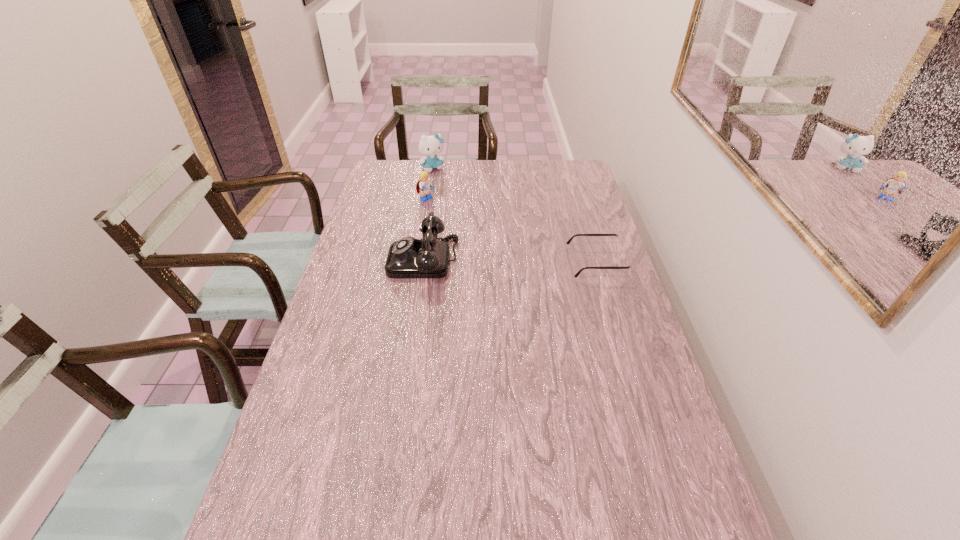
You are a GUI agent. You are given a task and a screenshot of the screen. Output one action in this format:
    pyautogui.click(x=<x>, y=<y>)
    Task: Click on the free space on the desktop that is between the telephone and the spectacles and is positioned on the front-facing side of the Lego
    
    Given the screenshot: What is the action you would take?
    pyautogui.click(x=522, y=261)

The height and width of the screenshot is (540, 960). Identify the location of vacant space on the desktop that is between the telephone and the shortest object and is positioned on the face of the kitten. (516, 261).